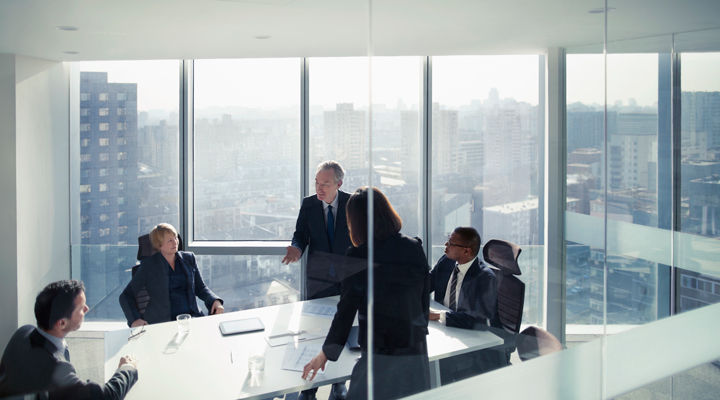
Find the location of a particular element. recessed lighting is located at coordinates (71, 27), (70, 51), (263, 39), (588, 11).